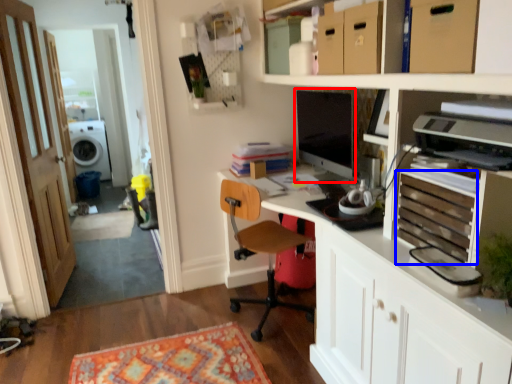
Question: Which point is further to the camera, computer monitor (highlighted by a red box) or drawer (highlighted by a blue box)?

Choices:
 (A) computer monitor
 (B) drawer

Answer: (A)